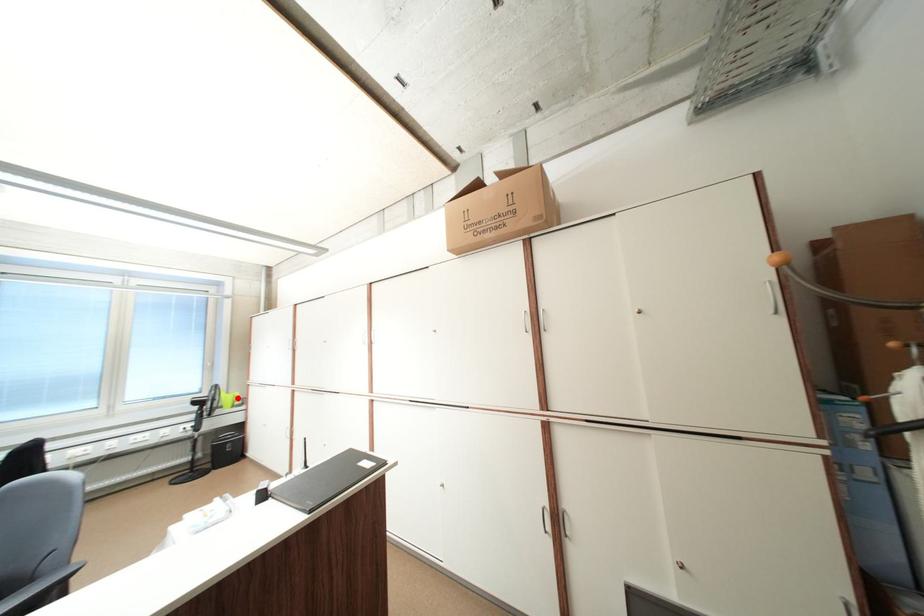
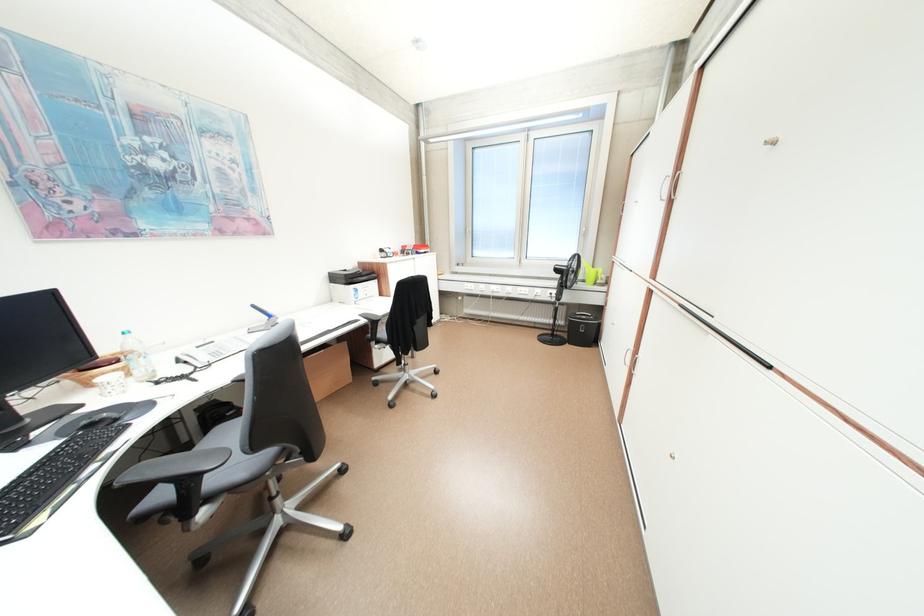
Locate, in the second image, the point that corresponds to the highlighted location in the first image.

(598, 273)